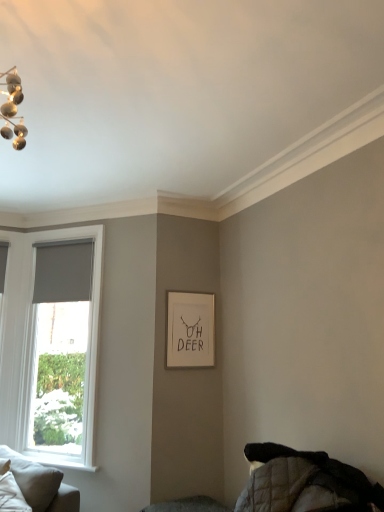
Question: Is light gray fabric couch at lower left far away from white soft pillow at lower left?

Choices:
 (A) yes
 (B) no

Answer: (B)

Question: From a real-world perspective, is light gray fabric couch at lower left positioned under white soft pillow at lower left based on gravity?

Choices:
 (A) no
 (B) yes

Answer: (B)

Question: Is light gray fabric couch at lower left placed right next to white soft pillow at lower left?

Choices:
 (A) no
 (B) yes

Answer: (A)

Question: Can you confirm if light gray fabric couch at lower left is bigger than white soft pillow at lower left?

Choices:
 (A) no
 (B) yes

Answer: (B)

Question: Is light gray fabric couch at lower left to the left of white soft pillow at lower left from the viewer's perspective?

Choices:
 (A) no
 (B) yes

Answer: (A)

Question: From a real-world perspective, relative to white soft pillow at lower left, is gray roller blind at left vertically above or below?

Choices:
 (A) above
 (B) below

Answer: (A)

Question: Considering the positions of gray roller blind at left and white soft pillow at lower left in the image, is gray roller blind at left taller or shorter than white soft pillow at lower left?

Choices:
 (A) tall
 (B) short

Answer: (A)

Question: Is gray roller blind at left spatially inside white soft pillow at lower left, or outside of it?

Choices:
 (A) outside
 (B) inside

Answer: (A)

Question: From the image's perspective, is gray roller blind at left positioned above or below white soft pillow at lower left?

Choices:
 (A) below
 (B) above

Answer: (B)

Question: From the image's perspective, is gray roller blind at left positioned above or below matte gray curtain at left?

Choices:
 (A) above
 (B) below

Answer: (B)

Question: Based on their sizes in the image, would you say gray roller blind at left is bigger or smaller than matte gray curtain at left?

Choices:
 (A) small
 (B) big

Answer: (B)

Question: Is gray roller blind at left in front of or behind matte gray curtain at left in the image?

Choices:
 (A) front
 (B) behind

Answer: (A)

Question: From a real-world perspective, is gray roller blind at left above or below matte gray curtain at left?

Choices:
 (A) above
 (B) below

Answer: (B)

Question: From a real-world perspective, relative to gray roller blind at left, is white matte picture frame at center vertically above or below?

Choices:
 (A) above
 (B) below

Answer: (A)

Question: Is white matte picture frame at center taller or shorter than gray roller blind at left?

Choices:
 (A) tall
 (B) short

Answer: (B)